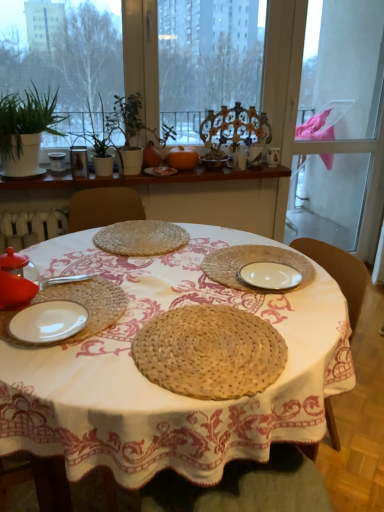
Identify the location of vacant space behind white matte plate at lower left, acting as the first plate starting from the front. This screenshot has height=512, width=384. (91, 261).